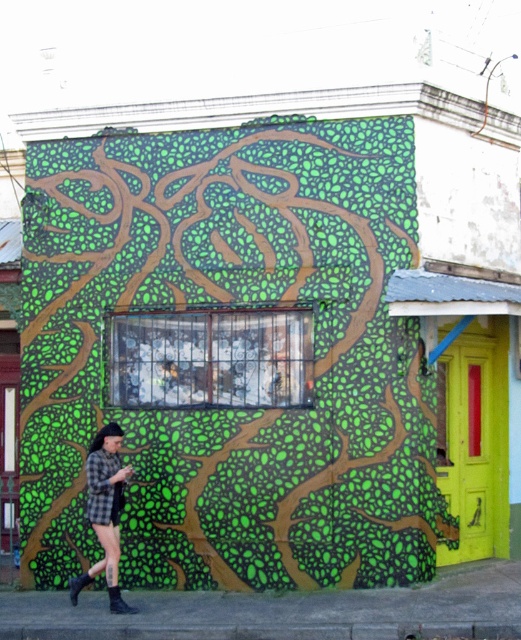
Measure the distance between green textured wall at center and camera.

They are 35.18 feet apart.

Does green textured wall at center appear on the left side of checkered fabric shorts at lower left?

No, green textured wall at center is not to the left of checkered fabric shorts at lower left.

Is point (317, 323) less distant than point (106, 570)?

No, (317, 323) is behind (106, 570).

Where is `green textured wall at center`? This screenshot has height=640, width=521. green textured wall at center is located at coordinates (229, 355).